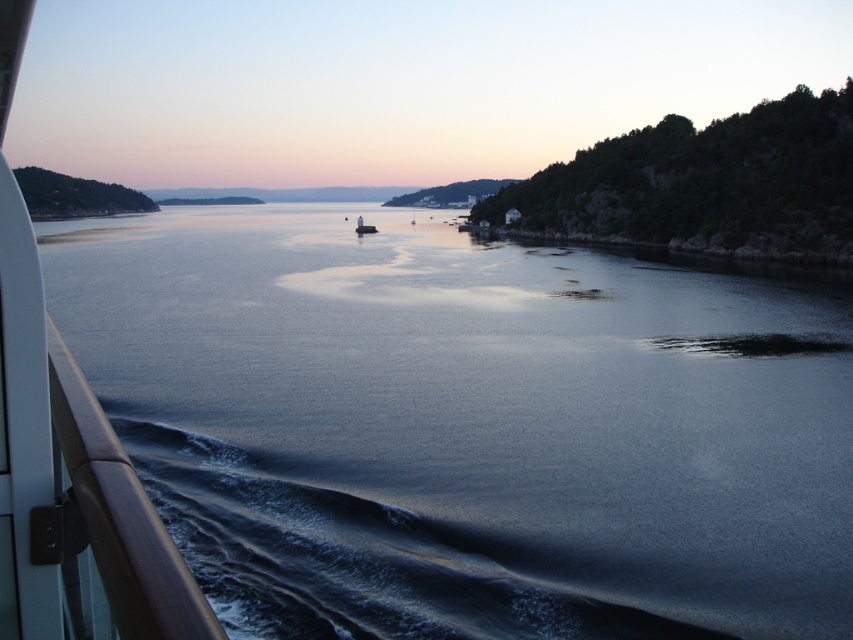
Question: Estimate the real-world distances between objects in this image. Which object is farther from the white glossy lighthouse at center?

Choices:
 (A) brown polished wood boat at left
 (B) glossy water at center

Answer: (A)

Question: Is the position of brown polished wood boat at left more distant than that of white glossy lighthouse at center?

Choices:
 (A) yes
 (B) no

Answer: (B)

Question: Can you confirm if glossy water at center is positioned to the left of brown polished wood boat at left?

Choices:
 (A) no
 (B) yes

Answer: (B)

Question: Can you confirm if glossy water at center is thinner than white glossy lighthouse at center?

Choices:
 (A) no
 (B) yes

Answer: (A)

Question: Among these points, which one is nearest to the camera?

Choices:
 (A) (694, 364)
 (B) (357, 218)
 (C) (38, 612)

Answer: (C)

Question: Based on their relative distances, which object is farther from the glossy water at center?

Choices:
 (A) brown polished wood boat at left
 (B) white glossy lighthouse at center

Answer: (B)